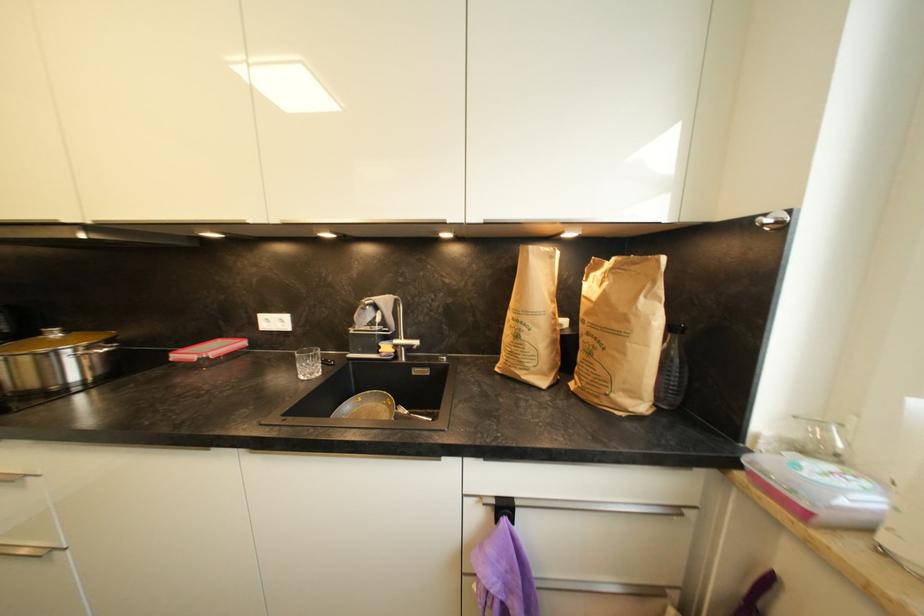
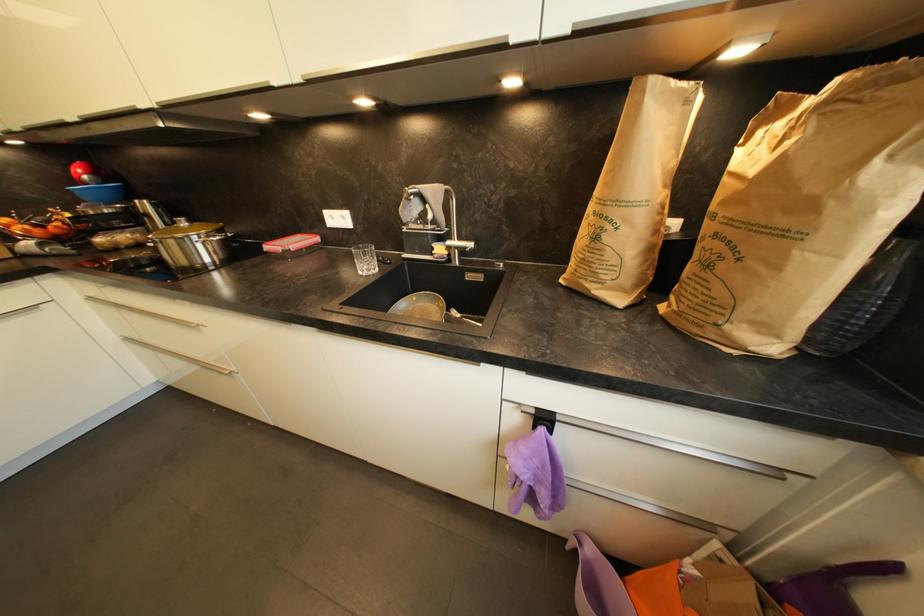
Question: What movement of the cameraman would produce the second image?

Choices:
 (A) Left
 (B) Right
 (C) Forward
 (D) Backward

Answer: (C)